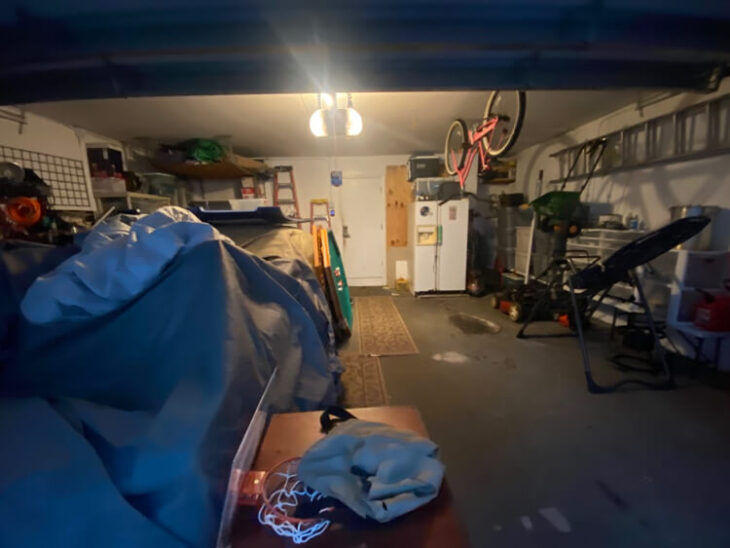
The image size is (730, 548). Find the location of `rugs`. rugs is located at coordinates (376, 331), (364, 386).